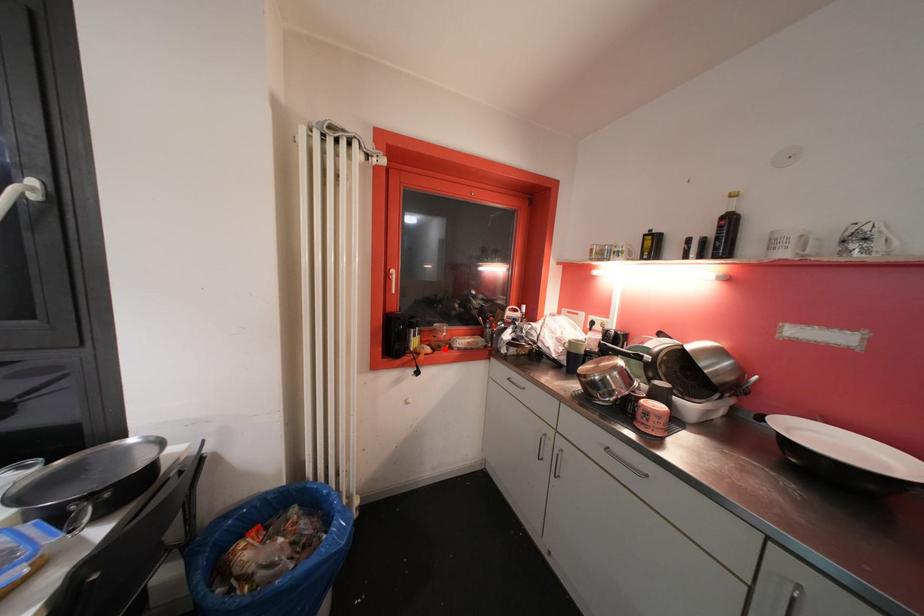
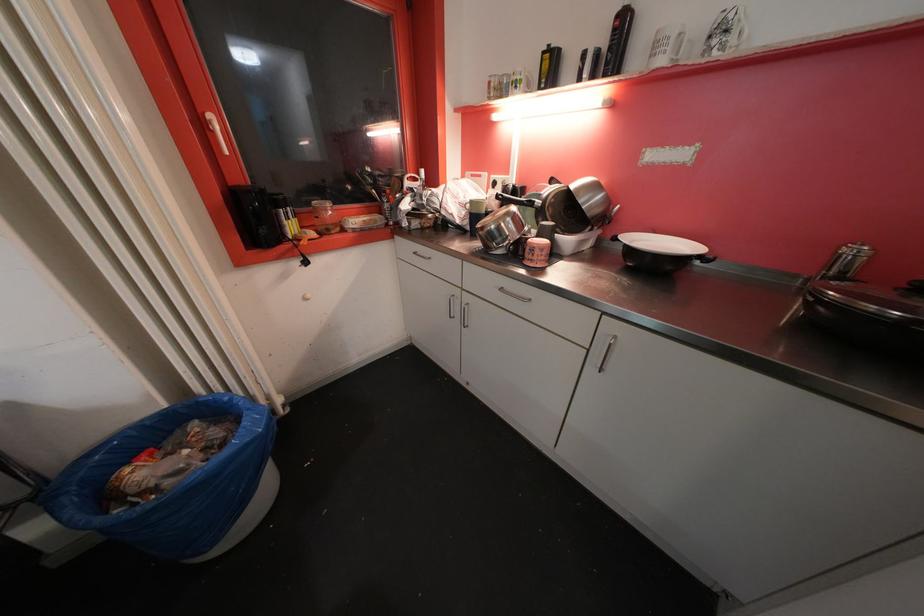
Locate, in the second image, the point that corresponds to the highlighted location in the first image.

(333, 233)